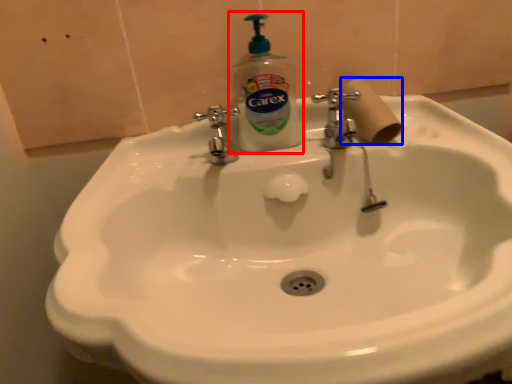
Question: Which point is further to the camera, soap dispenser (highlighted by a red box) or toilet paper (highlighted by a blue box)?

Choices:
 (A) soap dispenser
 (B) toilet paper

Answer: (B)